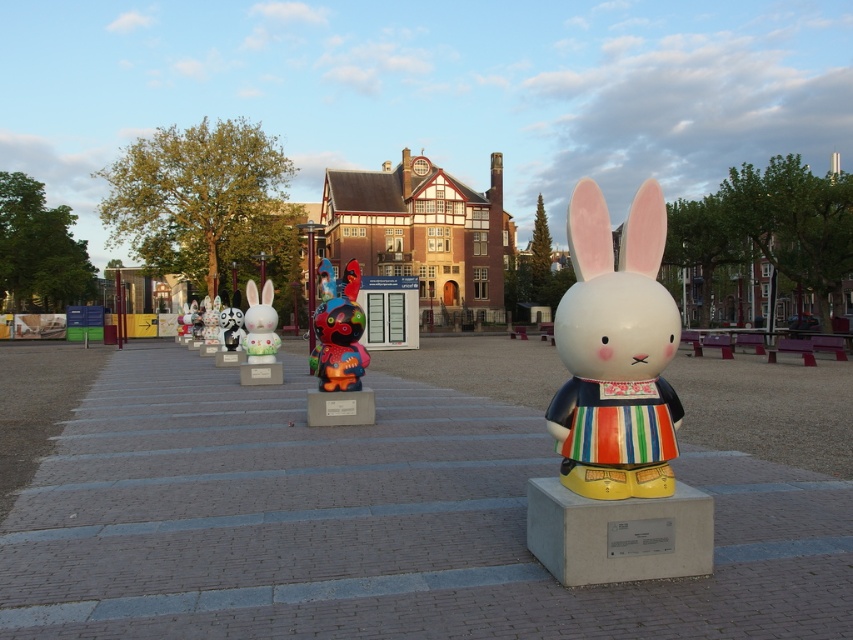
Question: Estimate the real-world distances between objects in this image. Which object is closer to the white glossy rabbit at center?

Choices:
 (A) matte ceramic rabbit at center
 (B) shiny multicolored rabbit at center

Answer: (B)

Question: Does shiny multicolored rabbit at center appear on the left side of white glossy rabbit at center?

Choices:
 (A) yes
 (B) no

Answer: (B)

Question: Is the position of shiny multicolored rabbit at center more distant than that of white glossy rabbit at center?

Choices:
 (A) no
 (B) yes

Answer: (A)

Question: Does matte ceramic rabbit at center appear under white glossy rabbit at center?

Choices:
 (A) no
 (B) yes

Answer: (A)

Question: Which point is farther to the camera?

Choices:
 (A) shiny multicolored rabbit at center
 (B) white glossy rabbit at center
 (C) matte ceramic rabbit at center

Answer: (B)

Question: Among these objects, which one is farthest from the camera?

Choices:
 (A) shiny multicolored rabbit at center
 (B) white glossy rabbit at center
 (C) matte ceramic rabbit at center

Answer: (B)